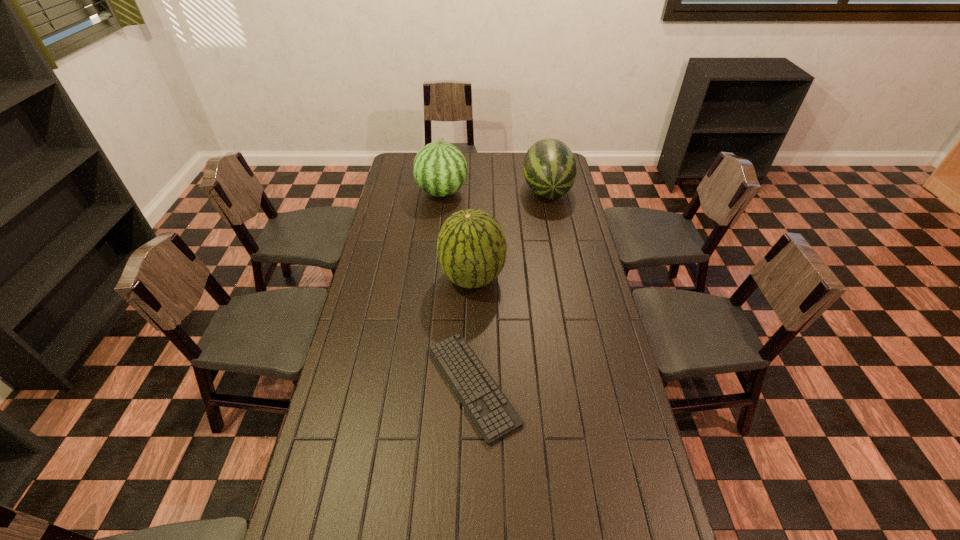
Locate an element on the screen. the nearest watermelon is located at coordinates (471, 247).

You are a GUI agent. You are given a task and a screenshot of the screen. Output one action in this format:
    pyautogui.click(x=<x>, y=<y>)
    Task: Click on the rightmost watermelon
    This screenshot has height=540, width=960.
    Given the screenshot: What is the action you would take?
    pyautogui.click(x=549, y=168)

This screenshot has height=540, width=960. I want to click on the shortest watermelon, so click(549, 168).

I want to click on computer keyboard, so click(492, 413).

Find the location of a particular element. the nearest object is located at coordinates (492, 413).

You are a GUI agent. You are given a task and a screenshot of the screen. Output one action in this format:
    pyautogui.click(x=<x>, y=<y>)
    Task: Click on the vacant space located 0.120m on the back of the second nearest object
    This screenshot has width=960, height=540.
    Given the screenshot: What is the action you would take?
    pyautogui.click(x=473, y=238)

Find the location of `vacant space located 0.190m on the back of the second shortest object`. vacant space located 0.190m on the back of the second shortest object is located at coordinates (540, 154).

I want to click on free location located 0.240m on the right of the nearest object, so click(597, 385).

Find the location of `object located at the far edge`. object located at the far edge is located at coordinates (549, 168).

Where is `object present at the left edge`? The image size is (960, 540). object present at the left edge is located at coordinates (440, 169).